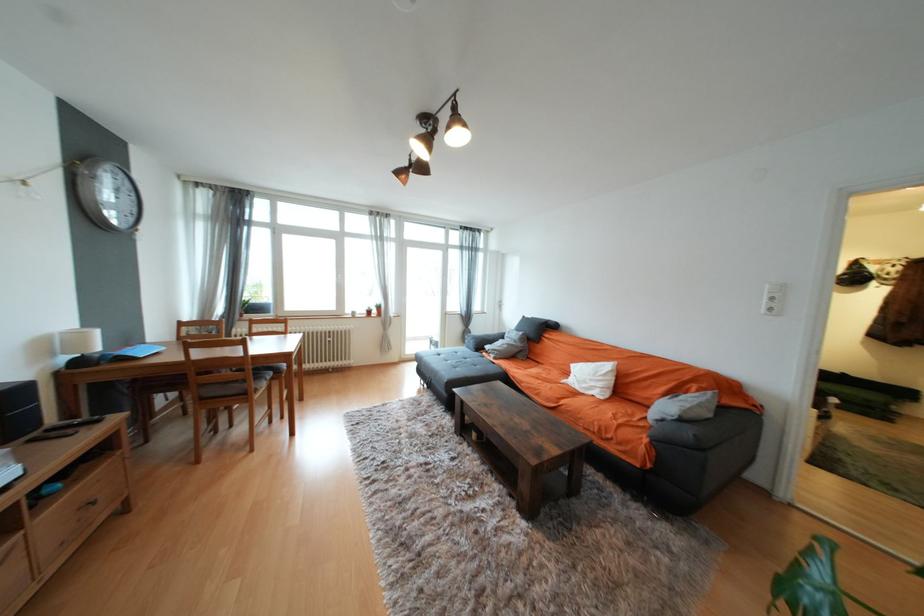
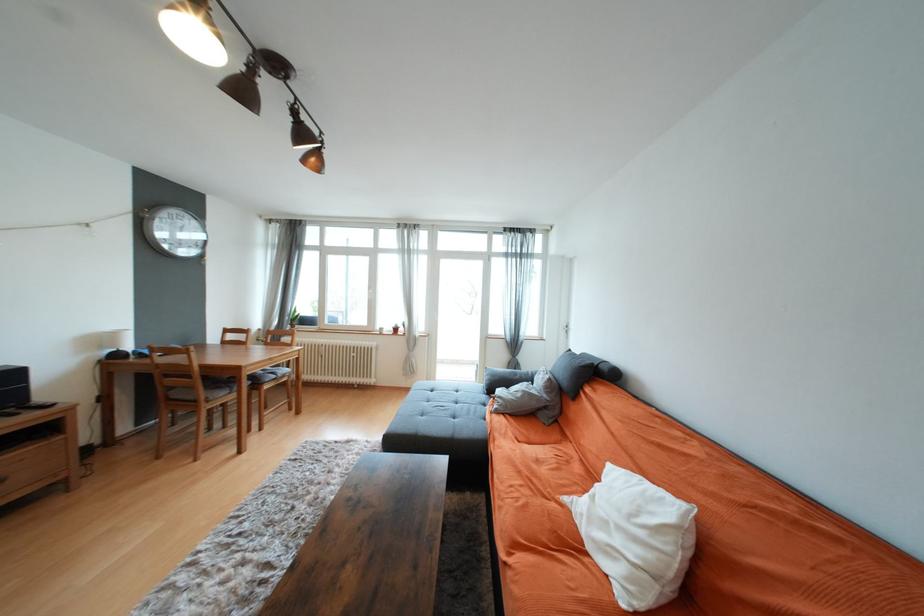
The point at (598, 381) is marked in the first image. Where is the corresponding point in the second image?

(625, 530)